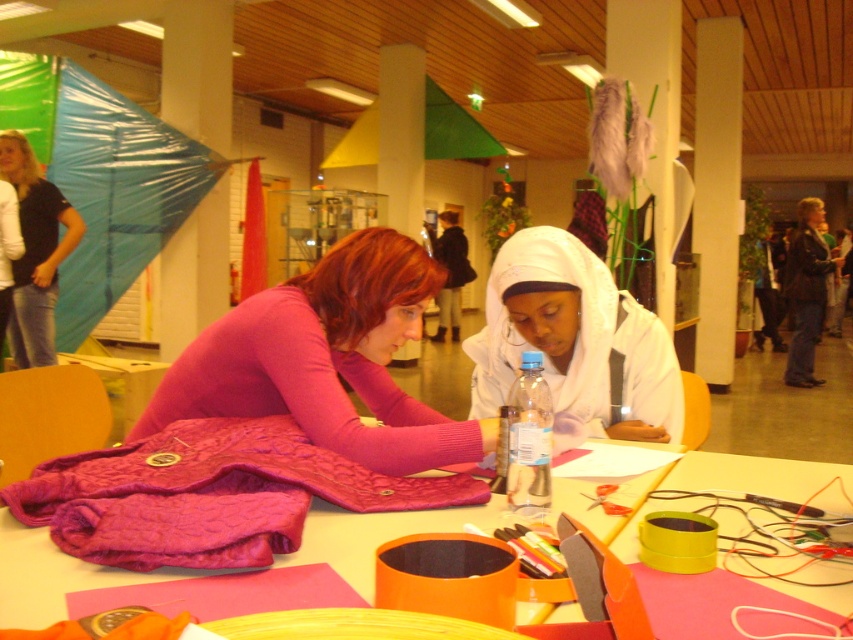
You are a photographer setting up a tripod in the center of the room. You notice the matte pink sweater at center and the white matte hijab at center. Which object should you adjust your camera angle to focus on first if you want to capture both items without moving the tripod?

The matte pink sweater at center is shorter than the white matte hijab at center. To capture both items, adjust the camera angle to focus on the shorter matte pink sweater at center first, then tilt slightly upwards to include the taller white matte hijab at center in the frame.